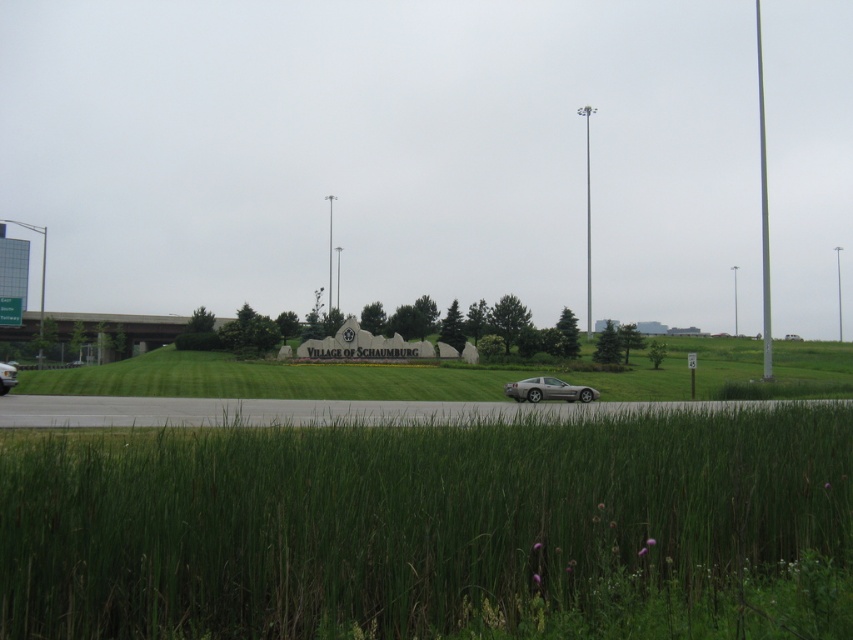
Question: Does green grass at lower center have a lesser width compared to silver metallic car at lower left?

Choices:
 (A) no
 (B) yes

Answer: (B)

Question: Can you confirm if green grass at center is thinner than silver metallic car at center?

Choices:
 (A) no
 (B) yes

Answer: (A)

Question: Which point is closer to the camera?

Choices:
 (A) (277, 392)
 (B) (4, 362)
 (C) (361, 540)
 (D) (582, 397)

Answer: (C)

Question: Is the position of green grass at center less distant than that of silver metallic car at center?

Choices:
 (A) yes
 (B) no

Answer: (A)

Question: Estimate the real-world distances between objects in this image. Which object is closer to the green grass at lower center?

Choices:
 (A) green grass at center
 (B) silver metallic car at lower left

Answer: (B)

Question: Which point is farther to the camera?

Choices:
 (A) silver metallic car at center
 (B) silver metallic car at lower left
 (C) green grass at center

Answer: (A)